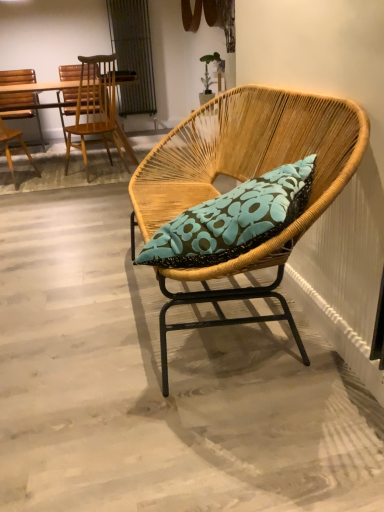
This screenshot has height=512, width=384. Find the location of `vacant area situated to the left side of woven wood chair at center, the 3th chair in the back-to-front sequence`. vacant area situated to the left side of woven wood chair at center, the 3th chair in the back-to-front sequence is located at coordinates pyautogui.click(x=63, y=297).